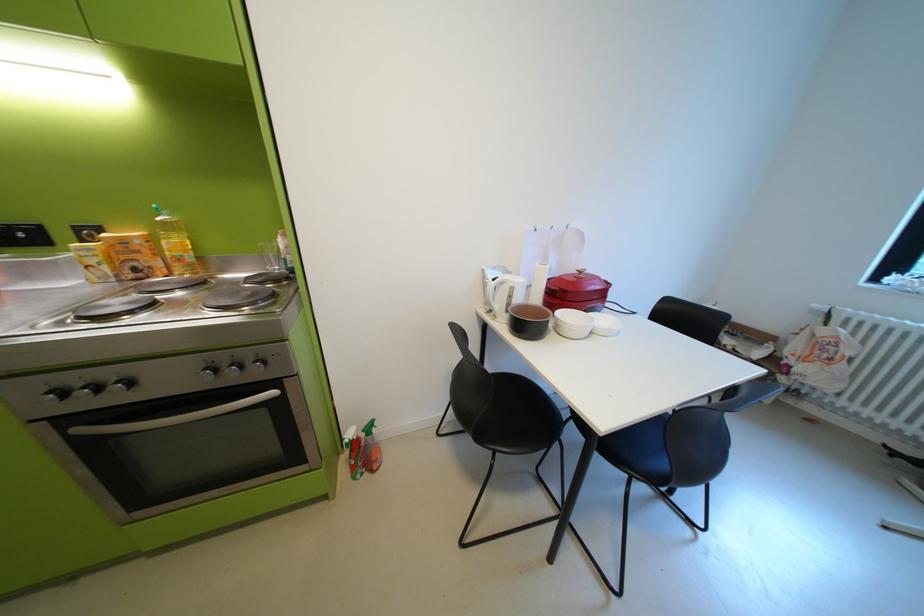
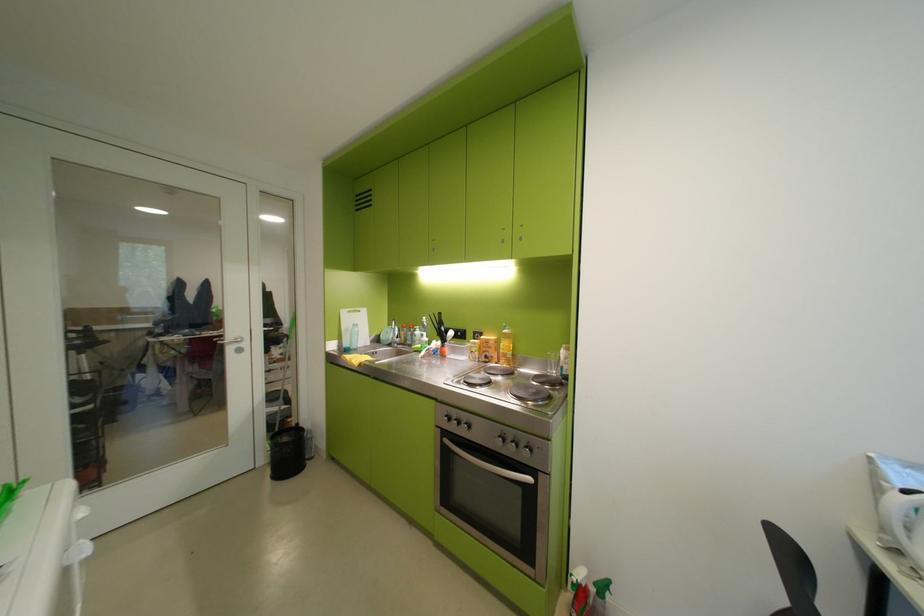
Locate, in the second image, the point that corresponds to point (149, 253) in the first image.

(501, 349)